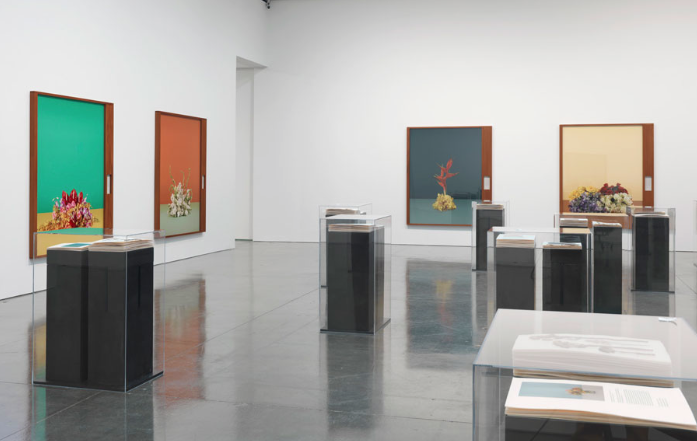
Locate an element on the screen. This screenshot has width=697, height=441. painting is located at coordinates (467, 190).